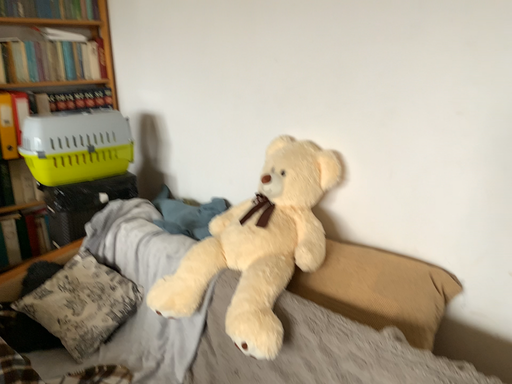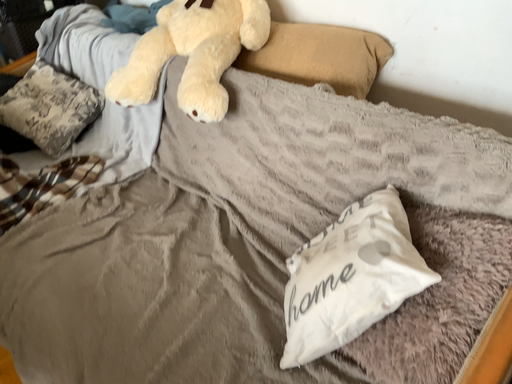
Question: Which way did the camera rotate in the video?

Choices:
 (A) rotated upward
 (B) rotated downward

Answer: (B)